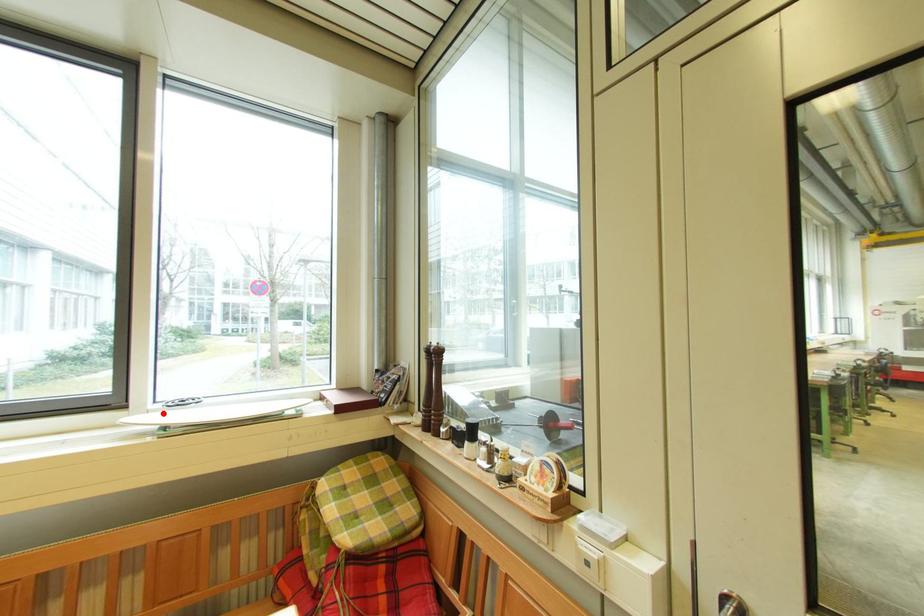
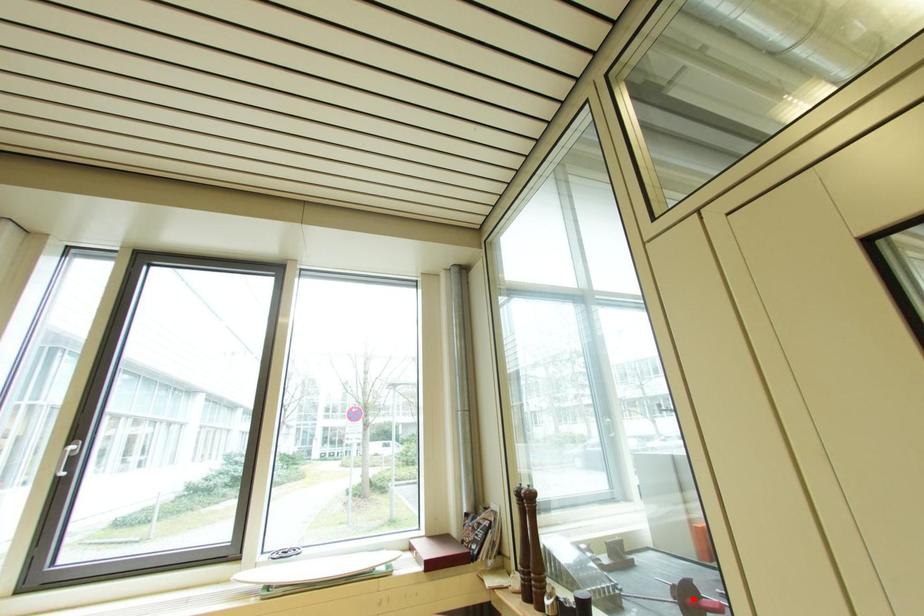
I am providing you with two images of the same scene from different viewpoints. A red point is marked on the first image and another point is marked on the second image. Are the points marked in image1 and image2 representing the same 3D position?

No